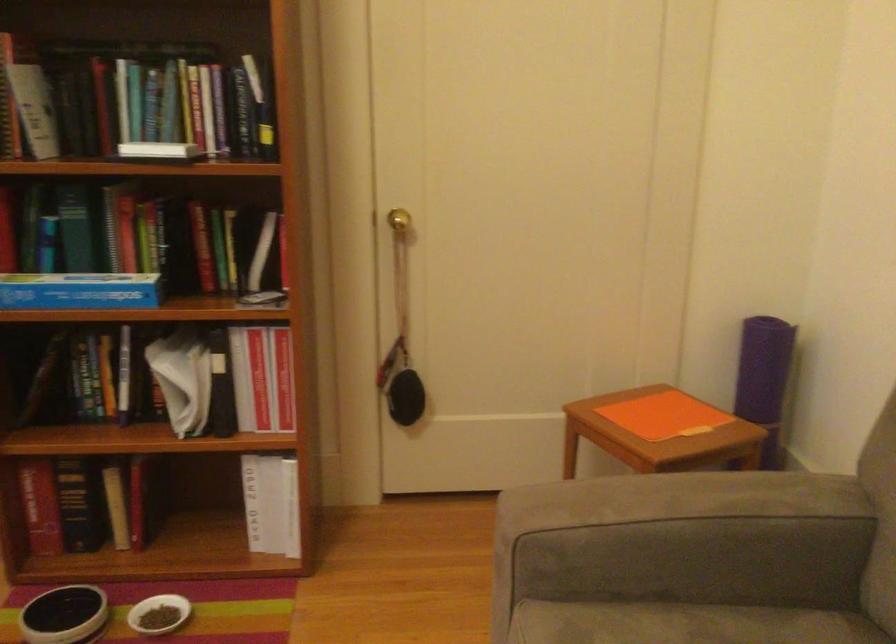
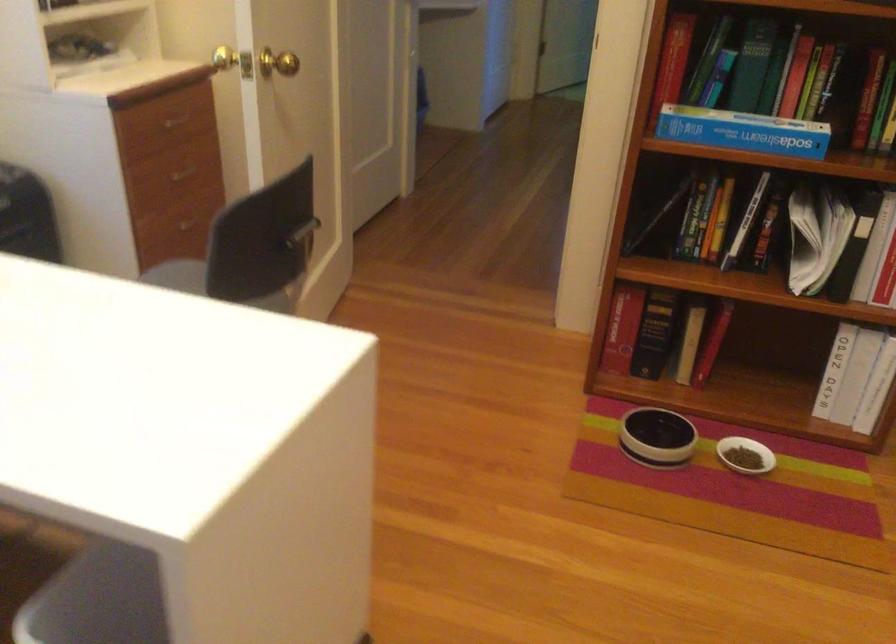
In the second image, find the point that corresponds to pixel 76 295 in the first image.

(743, 131)